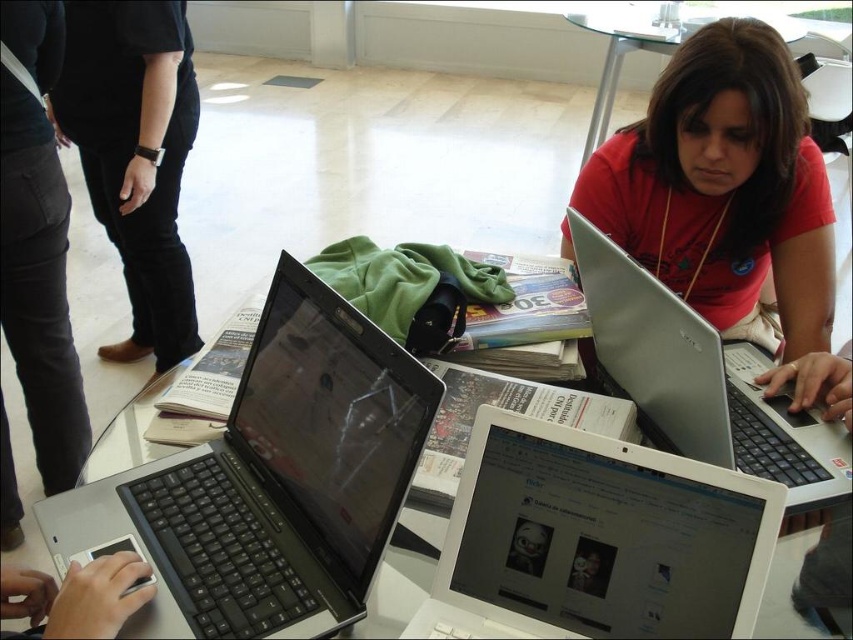
You are a person with black smooth pants at left and want to reach the black plastic laptops at center. Which direction should you move?

You should move to your right since the black plastic laptops at center are to the right of the black smooth pants at left.

Based on the photo, you are a person with a height of 1.7 meters standing at the edge of the glass table where the matte black laptop at center and white glossy laptop at center are placed. You want to reach for a pen that is on the table behind the laptops. Which laptop do you need to move first to access the pen?

You need to move the matte black laptop at center first because it is closer to you than the white glossy laptop at center, so moving it will allow access to the pen behind both laptops.

You are organizing a workshop and need to place two laptops on a table that can only accommodate a total width of 60 centimeters. The matte black laptop at center and the white glossy laptop at center are available. Given their sizes, can both fit on the table together?

The matte black laptop at center is larger in width than the white glossy laptop at center. Since their combined width must be under 60 centimeters, but we don not know their exact measurements, it is impossible to determine if both will fit without additional information about their specific dimensions.